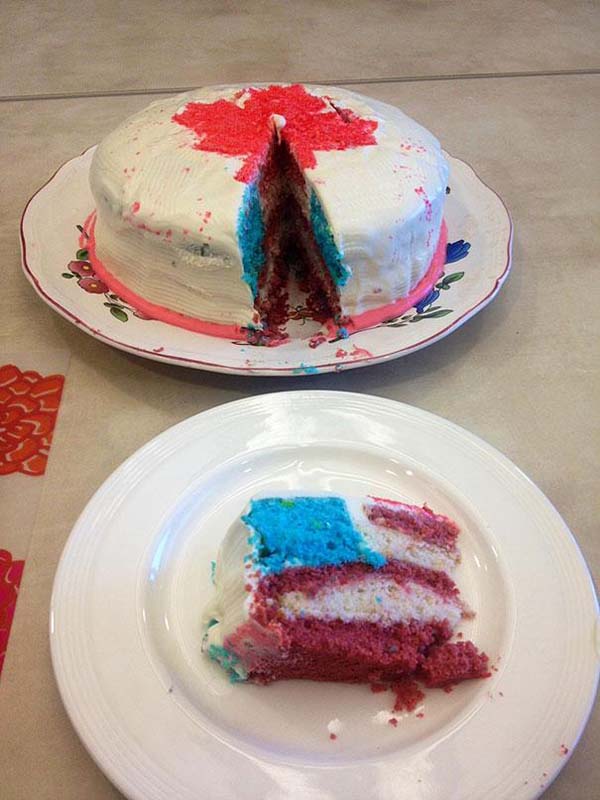
Where is `plates`? This screenshot has width=600, height=800. plates is located at coordinates (157, 618), (131, 332).